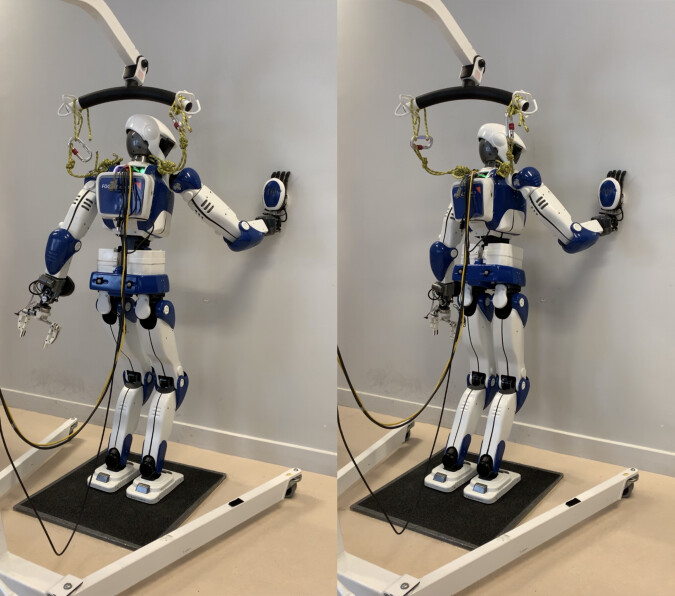
Find the location of a particular element. The width and height of the screenshot is (675, 596). back wall left side image is located at coordinates (243, 77), (188, 575).